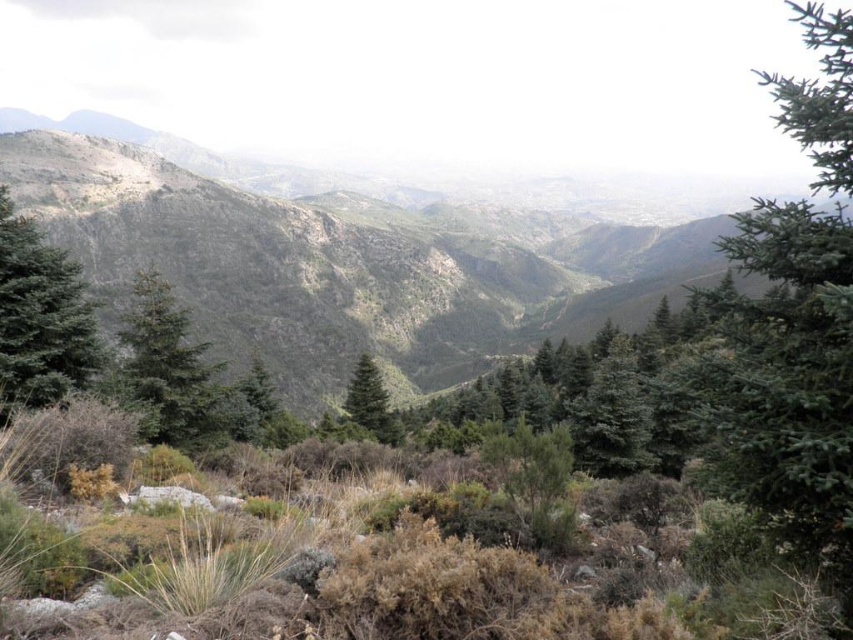
Question: Is the position of green textured mountain at center more distant than that of green matte tree at center-left?

Choices:
 (A) no
 (B) yes

Answer: (B)

Question: In this image, where is green textured mountain at center located relative to green matte tree at upper left?

Choices:
 (A) above
 (B) below

Answer: (A)

Question: Does green textured mountain at center have a lesser width compared to green matte tree at center-left?

Choices:
 (A) no
 (B) yes

Answer: (A)

Question: Based on their relative distances, which object is farther from the green textured mountain at center?

Choices:
 (A) green matte tree at center-left
 (B) green matte tree at center
 (C) green matte tree at upper left

Answer: (A)

Question: Considering the real-world distances, which object is farthest from the green matte tree at center?

Choices:
 (A) green matte tree at center-left
 (B) green matte tree at upper left
 (C) green textured mountain at center

Answer: (C)

Question: Which point appears farthest from the camera in this image?

Choices:
 (A) (157, 144)
 (B) (161, 298)
 (C) (90, 364)

Answer: (A)